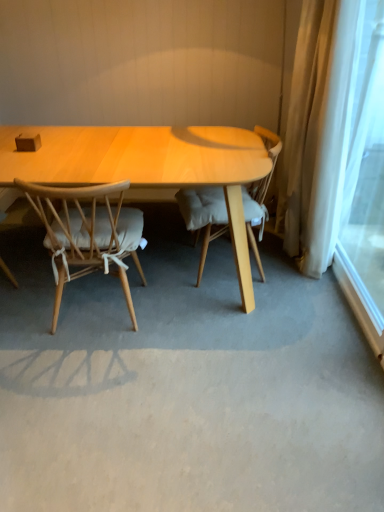
Question: Does light brown wood chair at center, the 2th chair positioned from the left, have a greater width compared to light wood chair with cushion at left, which is counted as the 1th chair, starting from the left?

Choices:
 (A) no
 (B) yes

Answer: (A)

Question: Does light brown wood chair at center, the 2th chair positioned from the left, contain light wood chair with cushion at left, arranged as the 2th chair when viewed from the right?

Choices:
 (A) no
 (B) yes

Answer: (A)

Question: Could you tell me if light brown wood chair at center, the 2th chair positioned from the left, is turned towards light wood chair with cushion at left, which is counted as the 1th chair, starting from the left?

Choices:
 (A) no
 (B) yes

Answer: (A)

Question: Considering the relative positions of light brown wood chair at center, marked as the 1th chair in a right-to-left arrangement, and light wood chair with cushion at left, which is counted as the 1th chair, starting from the left, in the image provided, is light brown wood chair at center, marked as the 1th chair in a right-to-left arrangement, to the right of light wood chair with cushion at left, which is counted as the 1th chair, starting from the left, from the viewer's perspective?

Choices:
 (A) no
 (B) yes

Answer: (B)

Question: Does light brown wood chair at center, the 2th chair positioned from the left, have a lesser width compared to light wood chair with cushion at left, arranged as the 2th chair when viewed from the right?

Choices:
 (A) no
 (B) yes

Answer: (B)

Question: Considering the relative sizes of light brown wood chair at center, marked as the 1th chair in a right-to-left arrangement, and light wood chair with cushion at left, arranged as the 2th chair when viewed from the right, in the image provided, is light brown wood chair at center, marked as the 1th chair in a right-to-left arrangement, taller than light wood chair with cushion at left, arranged as the 2th chair when viewed from the right,?

Choices:
 (A) yes
 (B) no

Answer: (A)

Question: Considering the relative sizes of light wood chair with cushion at left, arranged as the 2th chair when viewed from the right, and light brown wood chair at center, the 2th chair positioned from the left, in the image provided, is light wood chair with cushion at left, arranged as the 2th chair when viewed from the right, taller than light brown wood chair at center, the 2th chair positioned from the left,?

Choices:
 (A) yes
 (B) no

Answer: (B)

Question: Is light wood chair with cushion at left, arranged as the 2th chair when viewed from the right, completely or partially outside of light brown wood chair at center, the 2th chair positioned from the left?

Choices:
 (A) no
 (B) yes

Answer: (B)

Question: From a real-world perspective, does light wood chair with cushion at left, which is counted as the 1th chair, starting from the left, stand above light brown wood chair at center, the 2th chair positioned from the left?

Choices:
 (A) yes
 (B) no

Answer: (B)

Question: Is light wood chair with cushion at left, arranged as the 2th chair when viewed from the right, to the right of light brown wood chair at center, marked as the 1th chair in a right-to-left arrangement, from the viewer's perspective?

Choices:
 (A) yes
 (B) no

Answer: (B)

Question: Is light wood chair with cushion at left, arranged as the 2th chair when viewed from the right, in contact with light brown wood chair at center, the 2th chair positioned from the left?

Choices:
 (A) yes
 (B) no

Answer: (B)

Question: Is light wood chair with cushion at left, which is counted as the 1th chair, starting from the left, looking in the opposite direction of light brown wood chair at center, the 2th chair positioned from the left?

Choices:
 (A) no
 (B) yes

Answer: (A)

Question: Can you confirm if white sheer curtain at right is positioned to the left of light brown wood chair at center, the 2th chair positioned from the left?

Choices:
 (A) yes
 (B) no

Answer: (B)